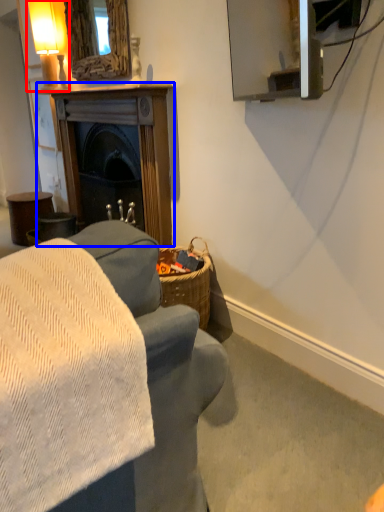
Question: Which of the following is the closest to the observer, table lamp (highlighted by a red box) or fireplace (highlighted by a blue box)?

Choices:
 (A) table lamp
 (B) fireplace

Answer: (B)